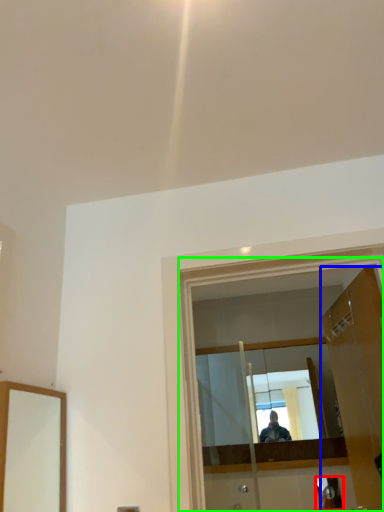
Question: Which object is the closest to the reflection (highlighted by a red box)? Choose among these: door (highlighted by a blue box) or glass door (highlighted by a green box).

Choices:
 (A) door
 (B) glass door

Answer: (A)